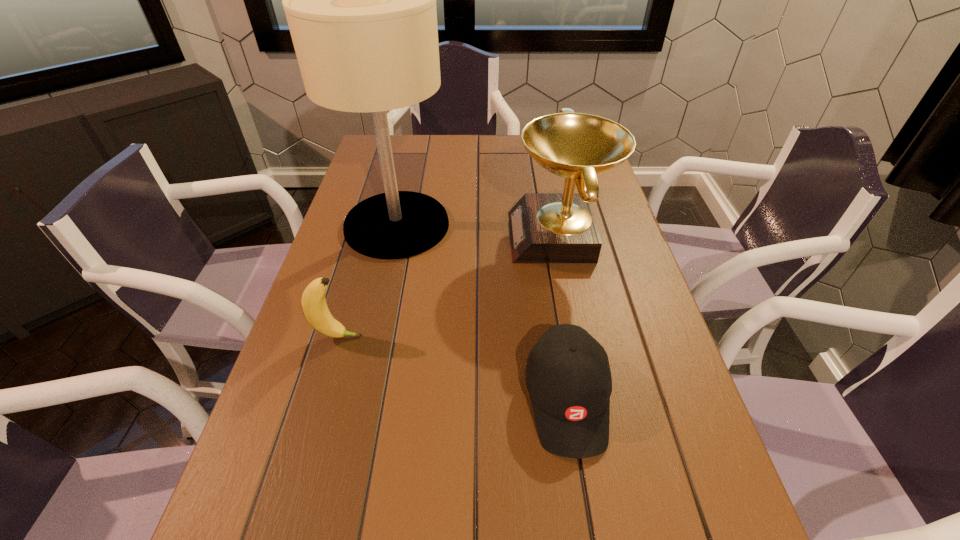
This screenshot has height=540, width=960. What are the coordinates of `vacant area situated 0.080m from the stem of the second nearest object` in the screenshot? It's located at (397, 336).

Find the location of a particular element. Image resolution: width=960 pixels, height=540 pixels. table lamp positioned at the left edge is located at coordinates (360, 0).

Where is `banana that is at the left edge`? The width and height of the screenshot is (960, 540). banana that is at the left edge is located at coordinates (313, 301).

At what (x,y) coordinates should I click in order to perform the action: click on award situated at the right edge. Please return your answer as a coordinate pair (x, y). This screenshot has height=540, width=960. Looking at the image, I should click on (544, 227).

Image resolution: width=960 pixels, height=540 pixels. I want to click on baseball cap that is at the right edge, so click(568, 377).

The image size is (960, 540). Find the location of `vacant point at the left edge`. vacant point at the left edge is located at coordinates (350, 249).

This screenshot has height=540, width=960. In the image, there is a desktop. Find the location of `vacant space at the right edge`. vacant space at the right edge is located at coordinates point(633,510).

You are a GUI agent. You are given a task and a screenshot of the screen. Output one action in this format:
    pyautogui.click(x=<x>, y=<y>)
    Task: Click on the free spot between the table lamp and the banana
    The image size is (960, 540).
    Given the screenshot: What is the action you would take?
    pos(368,281)

You are a GUI agent. You are given a task and a screenshot of the screen. Output one action in this format:
    pyautogui.click(x=<x>, y=<y>)
    Task: Click on the vacant space that's between the third shortest object and the nearest object
    The image size is (960, 540).
    Given the screenshot: What is the action you would take?
    pyautogui.click(x=564, y=318)

Where is `blank region between the shortest object and the table lamp`? This screenshot has width=960, height=540. blank region between the shortest object and the table lamp is located at coordinates (482, 312).